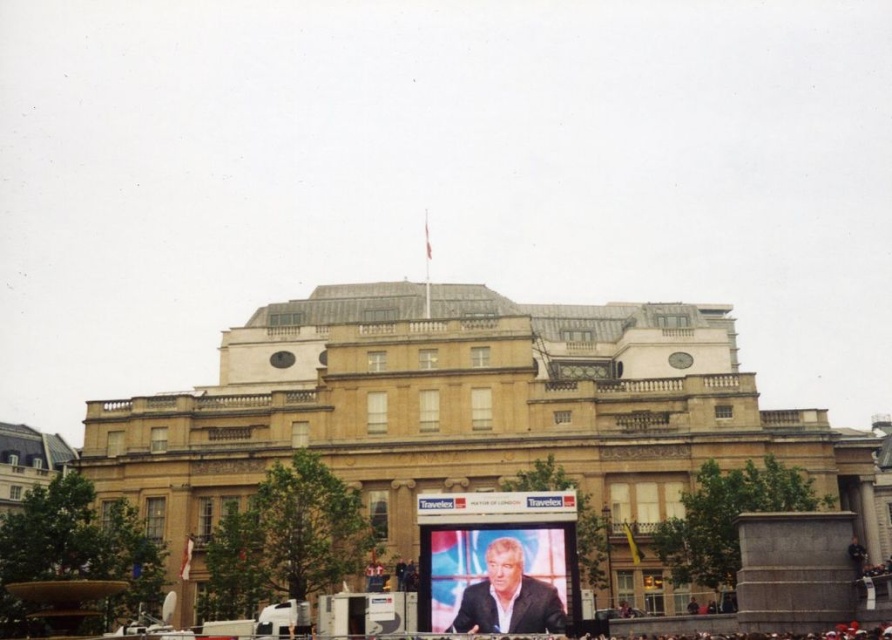
Is golden stone palace at center to the right of suit at center from the viewer's perspective?

Indeed, golden stone palace at center is positioned on the right side of suit at center.

Who is higher up, golden stone palace at center or suit at center?

golden stone palace at center is higher up.

At what (x,y) coordinates should I click in order to perform the action: click on golden stone palace at center. Please return your answer as a coordinate pair (x, y). This screenshot has height=640, width=892. Looking at the image, I should click on (469, 416).